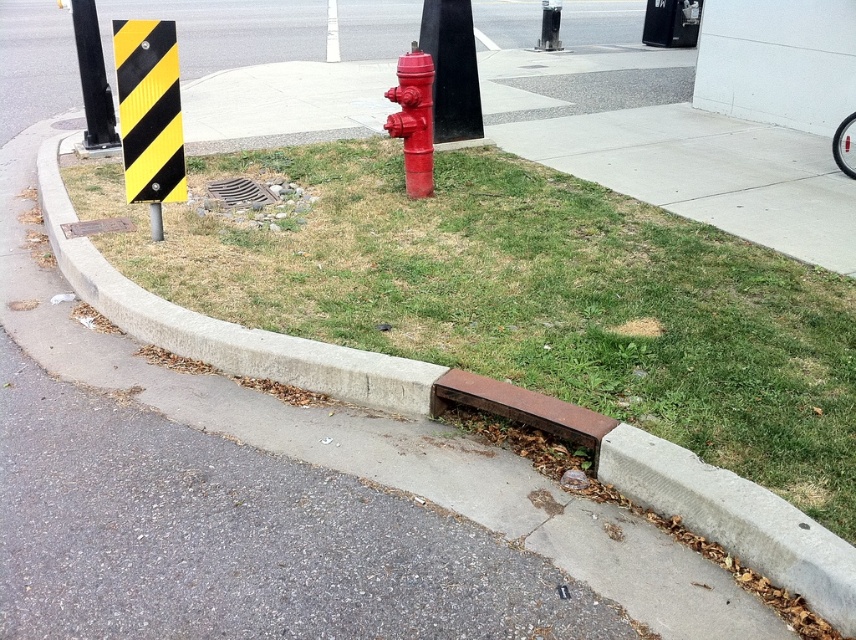
Question: Which is nearer to the smooth black pole at center?

Choices:
 (A) glossy red fire hydrant at center
 (B) brown dirt at center
 (C) black rubber pole at upper left
 (D) green grass at lower center

Answer: (A)

Question: Estimate the real-world distances between objects in this image. Which object is closer to the yellow/black striped sign at upper left?

Choices:
 (A) smooth black pole at center
 (B) green grass at lower center
 (C) metallic grate at center

Answer: (C)

Question: From the image, what is the correct spatial relationship of yellow/black striped sign at upper left in relation to metallic grate at center?

Choices:
 (A) above
 (B) below

Answer: (A)

Question: Is glossy red fire hydrant at center to the right of brown dirt at center from the viewer's perspective?

Choices:
 (A) yes
 (B) no

Answer: (B)

Question: Can you confirm if green grass at lower center is positioned to the right of yellow/black striped sign at upper left?

Choices:
 (A) yes
 (B) no

Answer: (A)

Question: Which is nearer to the smooth black pole at center?

Choices:
 (A) metallic grate at center
 (B) yellow/black striped sign at upper left

Answer: (A)